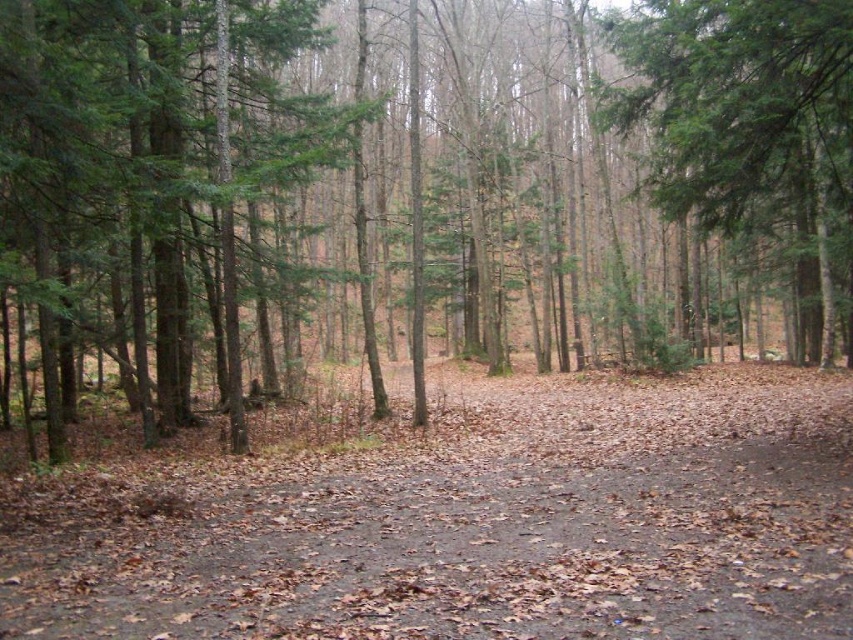
You are a hiker carrying a backpack and need to reach the green matte tree at upper right from the brown dirt trail at center. Considering your backpack weighs 15 kilograms, can you estimate how far you need to walk to reach the tree?

The distance between the brown dirt trail at center and the green matte tree at upper right is 6.53 meters, so you need to walk approximately 6.53 meters to reach the tree.

You are standing in the forest and want to walk from the point at coordinates point (64,99) to the point at coordinates point (196,513). Which direction should you move to get closer to your destination?

Since point (64,99) is further to the camera than point (196,513), you should move towards the direction away from the camera to reach your destination.